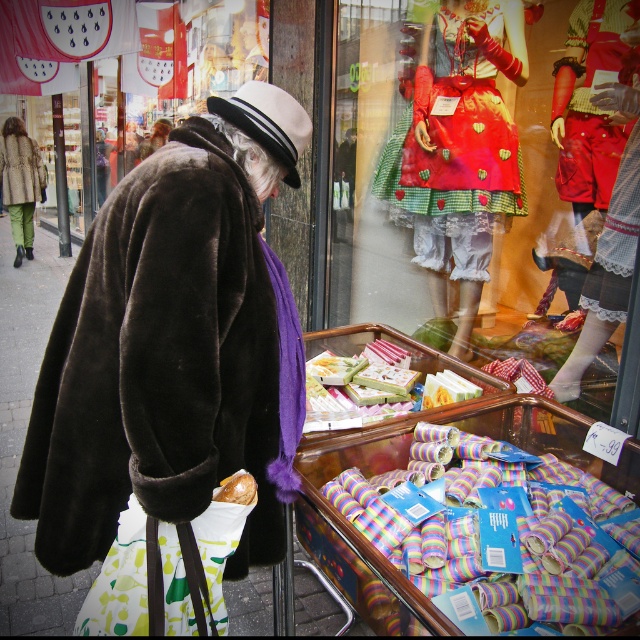
Question: Can you confirm if matte red fabric dress at center is positioned above white felt hat at center?

Choices:
 (A) yes
 (B) no

Answer: (A)

Question: Is velvety brown coat at center smaller than brown fur coat at left?

Choices:
 (A) no
 (B) yes

Answer: (A)

Question: Which of the following is the farthest from the observer?

Choices:
 (A) (435, 195)
 (B) (227, 419)

Answer: (A)

Question: Can you confirm if matte red fabric dress at center is wider than brown fur coat at left?

Choices:
 (A) no
 (B) yes

Answer: (B)

Question: Which is farther from the multicolored striped candy rolls at lower right?

Choices:
 (A) green corduroy pants at left
 (B) brown fur coat at left
 (C) gold foil candy at lower center
 (D) velvety brown coat at center

Answer: (B)

Question: Which point appears closest to the camera in this image?

Choices:
 (A) (193, 230)
 (B) (20, 212)

Answer: (A)